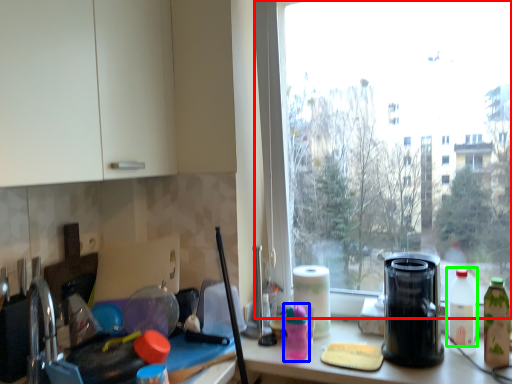
Question: Which object is positioned closest to window (highlighted by a red box)? Select from bottle (highlighted by a blue box) and bottle (highlighted by a green box).

Choices:
 (A) bottle
 (B) bottle

Answer: (B)